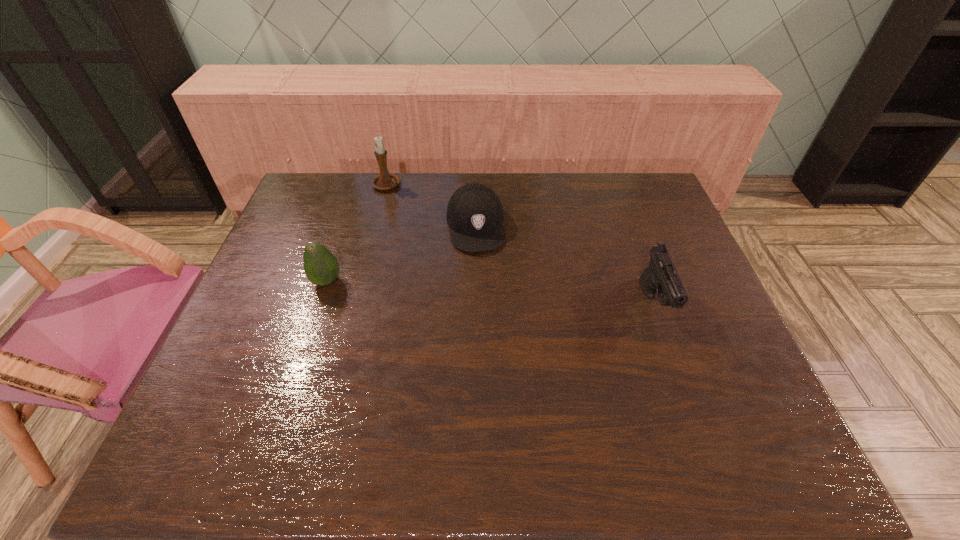
You are a GUI agent. You are given a task and a screenshot of the screen. Output one action in this format:
    pyautogui.click(x=<x>, y=<y>)
    Task: Click on the leftmost object
    Image resolution: width=960 pixels, height=540 pixels.
    Given the screenshot: What is the action you would take?
    pyautogui.click(x=321, y=267)

Locate an element on the screen. This screenshot has height=540, width=960. pistol is located at coordinates (661, 277).

At what (x,y) coordinates should I click in order to perform the action: click on the second farthest object. Please return your answer as a coordinate pair (x, y). Looking at the image, I should click on (474, 214).

This screenshot has width=960, height=540. I want to click on the third object from left to right, so click(x=474, y=214).

Locate an element on the screen. The height and width of the screenshot is (540, 960). candle holder is located at coordinates (384, 181).

You are a GUI agent. You are given a task and a screenshot of the screen. Output one action in this format:
    pyautogui.click(x=<x>, y=<y>)
    Task: Click on the third object from right to left
    
    Given the screenshot: What is the action you would take?
    pyautogui.click(x=384, y=181)

Identify the location of free spot located 0.190m on the back of the avocado. (345, 227).

Find the location of `free space located 0.110m at the barrel of the pistol`. free space located 0.110m at the barrel of the pistol is located at coordinates (680, 375).

At what (x,y) coordinates should I click in order to perform the action: click on vacant space located 0.340m on the front-facing side of the second object from right to left. Please return your answer as a coordinate pair (x, y). Looking at the image, I should click on (492, 354).

You are a GUI agent. You are given a task and a screenshot of the screen. Output one action in this format:
    pyautogui.click(x=<x>, y=<y>)
    Task: Click on the vacant space situated on the front-facing side of the second object from right to left
    The width and height of the screenshot is (960, 540).
    Given the screenshot: What is the action you would take?
    pyautogui.click(x=489, y=327)